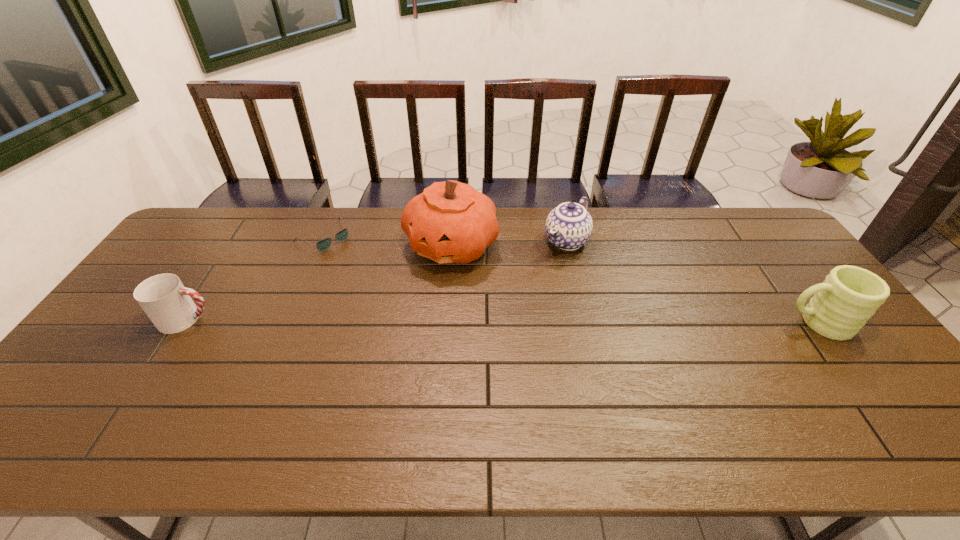
You are a GUI agent. You are given a task and a screenshot of the screen. Output one action in this format:
    pyautogui.click(x=<x>, y=<y>)
    Task: Click on the vacant area that satisfies the following two spatial constraints: 1. on the back side of the chinaware; 2. on the right side of the tallest object
    Image resolution: width=960 pixels, height=540 pixels.
    Given the screenshot: What is the action you would take?
    pyautogui.click(x=451, y=241)

Where is `free space that satisfies the following two spatial constraints: 1. on the front side of the chinaware; 2. on the left side of the sunglasses`? free space that satisfies the following two spatial constraints: 1. on the front side of the chinaware; 2. on the left side of the sunglasses is located at coordinates (323, 241).

Identify the location of free spot that satisfies the following two spatial constraints: 1. on the back side of the fourth object from left to right; 2. on the left side of the tallest object. (451, 241).